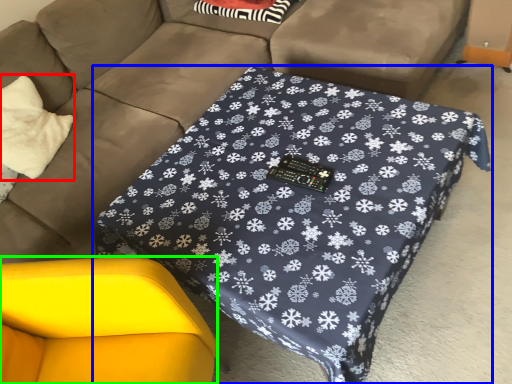
Question: Estimate the real-world distances between objects in this image. Which object is closer to throw pillow (highlighted by a red box), table (highlighted by a blue box) or swivel chair (highlighted by a green box)?

Choices:
 (A) table
 (B) swivel chair

Answer: (B)